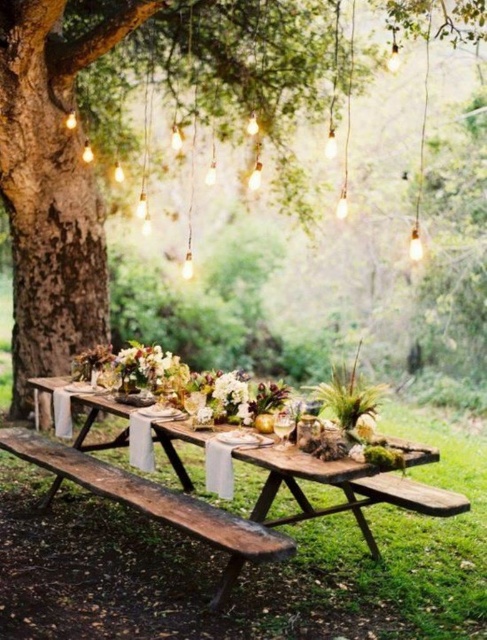
You are a guest at this outdoor event and want to find a place to sit. You see the brown wooden tree trunk at center and the rustic wooden table at center. Which object is higher from the ground?

The brown wooden tree trunk at center is located above the rustic wooden table at center, so it is higher from the ground.

You are a photographer standing at the edge of the garden where the rustic wood picnic table at center is set up. You want to take a photo of the table from a distance that ensures it fills the frame without being too close. Considering the camera you are using has a maximum zoom of 2x, what is the minimum distance you need to be from the table to achieve this?

The rustic wood picnic table at center is 3.25 meters away. Since the camera can zoom up to 2x, you can be as far as 3.25 meters away and still capture the table at an appropriate size in the frame without needing to get closer.

You are planning to place a large centerpiece on the rustic wood picnic table at center. Based on the coordinates provided, where exactly should you position it?

The rustic wood picnic table at center is located at point (x=337, y=486), so the large centerpiece should be placed at the center coordinates of the table, which is approximately at those coordinates.